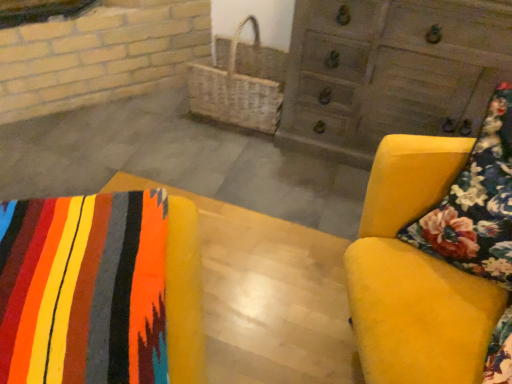
This screenshot has width=512, height=384. What are the coordinates of `vacant point above textured wool blanket at lower left, the 1th furniture viewed from the left (from a real-world perspective)` in the screenshot? It's located at (82, 266).